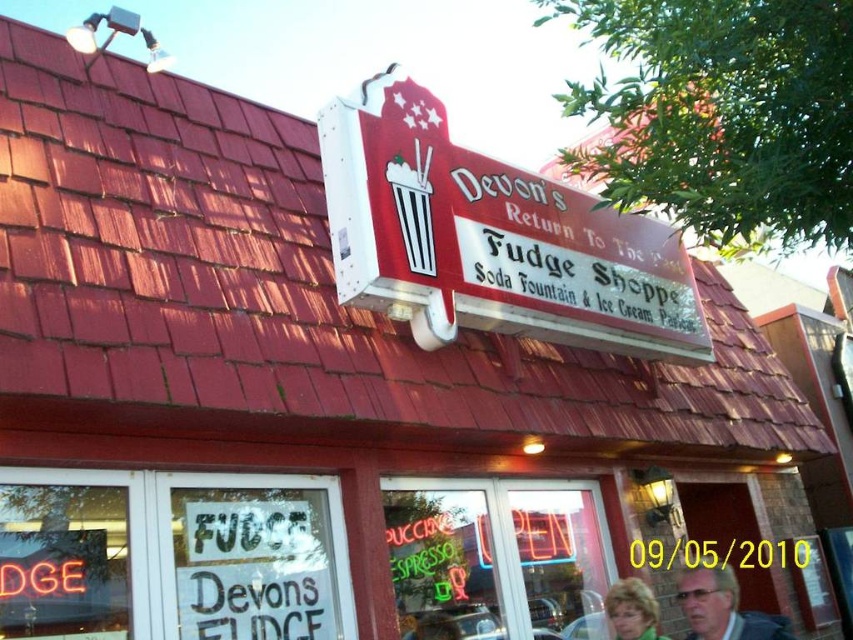
Consider the image. You are a customer standing outside Devon s Fudge Shoppe and you see two people inside the shop through the window. One has matte gray hair at center and the other has blonde hair at center. Which person appears taller when viewed from outside?

The matte gray hair at center appears taller than the blonde hair at center because it has a larger size compared to the blonde hair at center.

You are a customer entering Devon s Fudge Shoppe and you see the matte red sign at center and the blonde hair at center. Which object is larger in size?

The matte red sign at center is bigger than blonde hair at center.

You are a customer looking at two people sitting at the counter of Devon s Fudge Shoppe. You notice one has matte gray hair at center and the other has blonde hair at center. Which person is sitting to the right of the other?

The matte gray hair at center is positioned on the right side of blonde hair at center, so the person with matte gray hair at center is sitting to the right of the person with blonde hair at center.